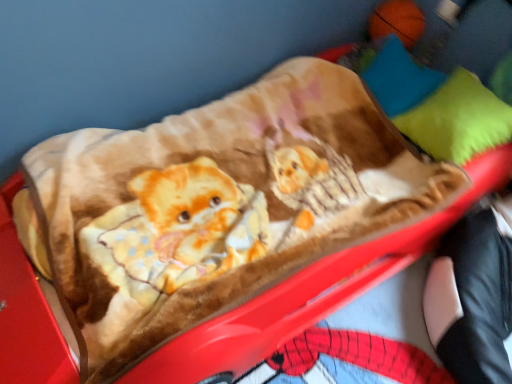
Question: Does green soft pillow at upper right, the 1th pillow in the bottom-to-top sequence, have a lesser height compared to blue soft pillow at upper right, the 2th pillow ordered from the bottom?

Choices:
 (A) no
 (B) yes

Answer: (A)

Question: Is green soft pillow at upper right, the 1th pillow in the bottom-to-top sequence, to the left of blue soft pillow at upper right, the 2th pillow ordered from the bottom, from the viewer's perspective?

Choices:
 (A) no
 (B) yes

Answer: (A)

Question: Is green soft pillow at upper right, arranged as the second pillow when viewed from the top, thinner than blue soft pillow at upper right, the 1th pillow when ordered from top to bottom?

Choices:
 (A) yes
 (B) no

Answer: (B)

Question: Is green soft pillow at upper right, arranged as the second pillow when viewed from the top, further to the viewer compared to blue soft pillow at upper right, the 1th pillow when ordered from top to bottom?

Choices:
 (A) yes
 (B) no

Answer: (B)

Question: From a real-world perspective, is green soft pillow at upper right, arranged as the second pillow when viewed from the top, located higher than blue soft pillow at upper right, the 1th pillow when ordered from top to bottom?

Choices:
 (A) yes
 (B) no

Answer: (A)

Question: Can you confirm if green soft pillow at upper right, arranged as the second pillow when viewed from the top, is positioned to the right of blue soft pillow at upper right, the 1th pillow when ordered from top to bottom?

Choices:
 (A) yes
 (B) no

Answer: (A)

Question: Is blue soft pillow at upper right, the 2th pillow ordered from the bottom, completely or partially inside black leather pants at lower right?

Choices:
 (A) no
 (B) yes

Answer: (A)

Question: Does black leather pants at lower right lie in front of blue soft pillow at upper right, the 1th pillow when ordered from top to bottom?

Choices:
 (A) no
 (B) yes

Answer: (B)

Question: Could you tell me if black leather pants at lower right is turned towards blue soft pillow at upper right, the 1th pillow when ordered from top to bottom?

Choices:
 (A) no
 (B) yes

Answer: (A)

Question: Does black leather pants at lower right have a lesser width compared to blue soft pillow at upper right, the 2th pillow ordered from the bottom?

Choices:
 (A) yes
 (B) no

Answer: (B)

Question: Considering the relative sizes of black leather pants at lower right and blue soft pillow at upper right, the 2th pillow ordered from the bottom, in the image provided, is black leather pants at lower right taller than blue soft pillow at upper right, the 2th pillow ordered from the bottom,?

Choices:
 (A) yes
 (B) no

Answer: (A)

Question: Is black leather pants at lower right to the right of blue soft pillow at upper right, the 1th pillow when ordered from top to bottom, from the viewer's perspective?

Choices:
 (A) no
 (B) yes

Answer: (B)

Question: Can you confirm if blue soft pillow at upper right, the 1th pillow when ordered from top to bottom, is thinner than black leather pants at lower right?

Choices:
 (A) yes
 (B) no

Answer: (A)